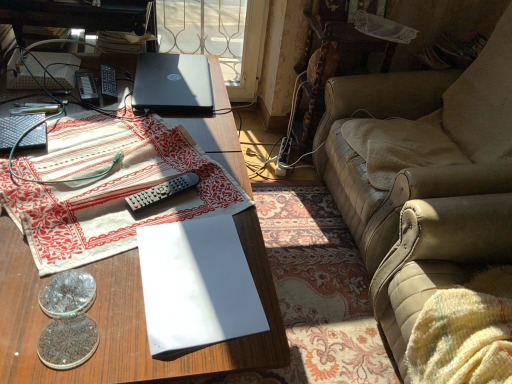
Where is `vacant area that lies between black plastic remote control at center, the first remote control in the top-to-bottom sequence, and white cotton tablecloth at left`? The width and height of the screenshot is (512, 384). vacant area that lies between black plastic remote control at center, the first remote control in the top-to-bottom sequence, and white cotton tablecloth at left is located at coordinates (67, 96).